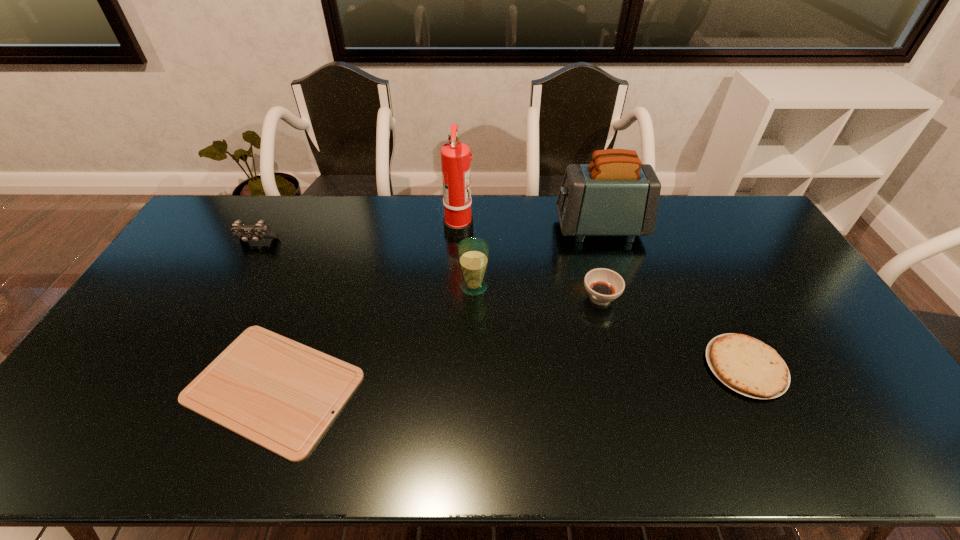
Where is `vacant space at the far edge`? The width and height of the screenshot is (960, 540). vacant space at the far edge is located at coordinates (407, 234).

The width and height of the screenshot is (960, 540). I want to click on vacant region at the near edge of the desktop, so click(x=814, y=463).

Find the location of a particular element. The width and height of the screenshot is (960, 540). blank space at the right edge of the desktop is located at coordinates coord(801,299).

Locate an element on the screen. vacant space at the far left corner of the desktop is located at coordinates (243, 203).

At what (x,y) coordinates should I click in order to perform the action: click on vacant space at the far right corner. Please return your answer as a coordinate pair (x, y). Looking at the image, I should click on (722, 214).

Find the location of `vacant area between the toaster and the tortilla`. vacant area between the toaster and the tortilla is located at coordinates (673, 298).

Identify the location of free space between the fourth tallest object and the shortest object. (265, 314).

This screenshot has height=540, width=960. What are the coordinates of `free space between the tallest object and the control` in the screenshot? It's located at (358, 234).

In order to click on unoccupied position between the toaster and the chopping board in this screenshot , I will do `click(437, 308)`.

The image size is (960, 540). I want to click on vacant space in between the third tallest object and the soup bowl, so click(538, 292).